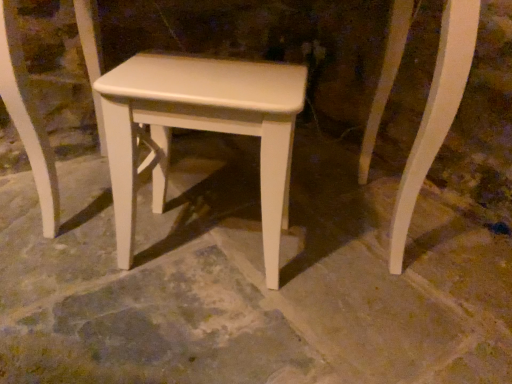
You are a GUI agent. You are given a task and a screenshot of the screen. Output one action in this format:
    pyautogui.click(x=<x>, y=<y>)
    Task: Click on the vacant space underneath white matte stool at center (from a real-world perspective)
    This screenshot has width=512, height=384.
    Given the screenshot: What is the action you would take?
    pyautogui.click(x=206, y=252)